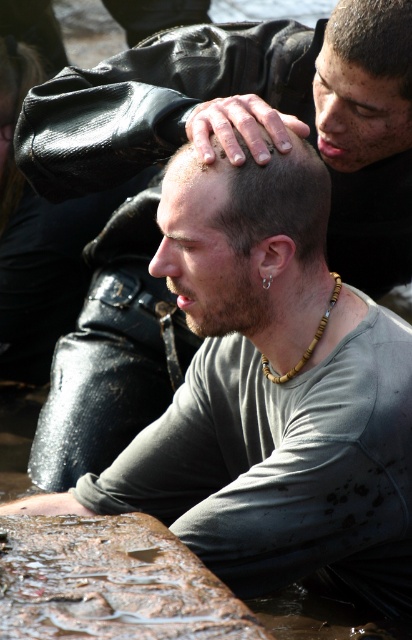
What is the object located at the coordinates point (233, 262) in the image?

The object located at point (233, 262) is the shiny black hair at center.

Based on the photo, you are navigating through a rugged outdoor area and need to reach a checkpoint. You see two points marked as point (294, 307) and point (407, 20). Which point is closer to your current position if you are standing behind both points?

Point (407, 20) is closer to your current position because point (294, 307) is behind it.